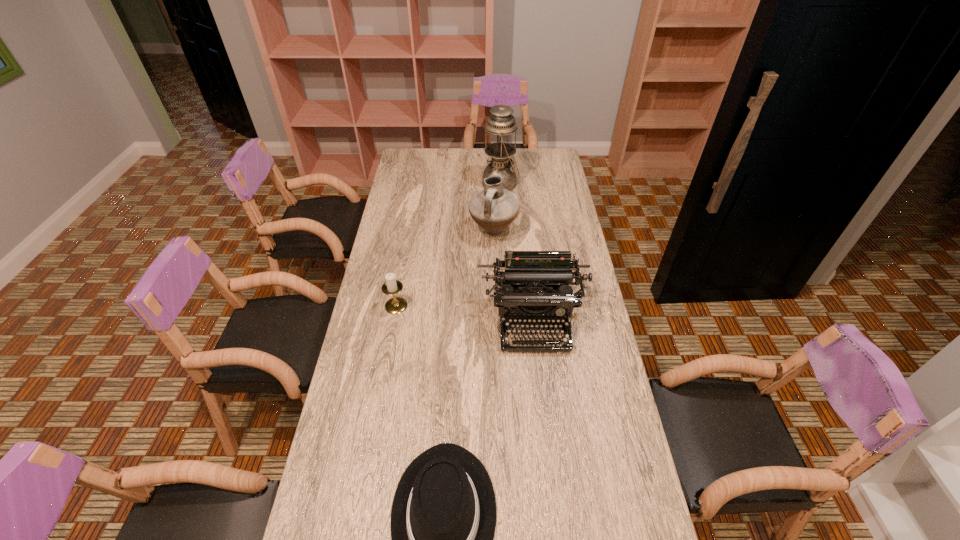
Locate an element on the screen. the farthest object is located at coordinates (501, 125).

Locate an element on the screen. the tallest object is located at coordinates (501, 125).

Where is `the second farthest object`? This screenshot has width=960, height=540. the second farthest object is located at coordinates (494, 208).

Find the location of a particular element. The height and width of the screenshot is (540, 960). typewriter is located at coordinates (534, 282).

Locate an element on the screen. The image size is (960, 540). the second shortest object is located at coordinates (395, 305).

At what (x,y) coordinates should I click in order to perform the action: click on candle holder. Please return your answer as a coordinate pair (x, y). Looking at the image, I should click on (395, 305).

I want to click on free location located 0.090m on the right of the farthest object, so click(x=538, y=184).

The width and height of the screenshot is (960, 540). I want to click on vacant space located on the handle side of the fourth nearest object, so click(x=494, y=268).

This screenshot has height=540, width=960. I want to click on vacant area situated on the keyboard of the typewriter, so click(x=543, y=424).

What are the coordinates of `free space located on the back of the fourth tallest object` in the screenshot? It's located at (406, 252).